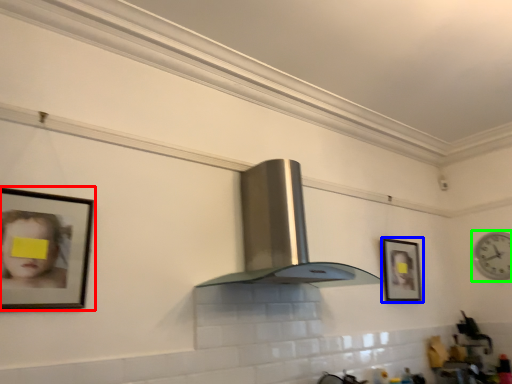
Question: Which object is positioned closest to picture frame (highlighted by a red box)? Select from picture frame (highlighted by a blue box) and clock (highlighted by a green box).

Choices:
 (A) picture frame
 (B) clock

Answer: (A)